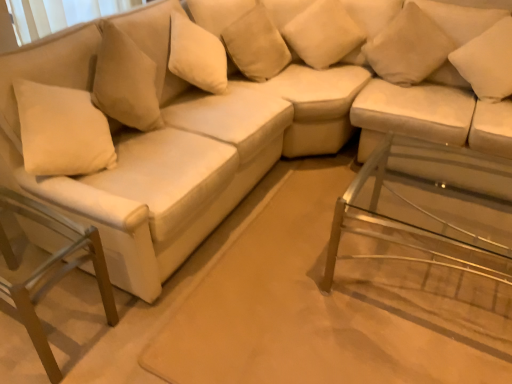
Question: Does metallic silver swivel chair at lower left come in front of beige fabric pillow at upper center, which appears as the 3th pillow when viewed from the right?

Choices:
 (A) yes
 (B) no

Answer: (A)

Question: Considering the relative sizes of metallic silver swivel chair at lower left and beige fabric pillow at upper center, which ranks as the 2th pillow in left-to-right order, in the image provided, is metallic silver swivel chair at lower left taller than beige fabric pillow at upper center, which ranks as the 2th pillow in left-to-right order,?

Choices:
 (A) yes
 (B) no

Answer: (A)

Question: Considering the relative sizes of metallic silver swivel chair at lower left and beige fabric pillow at upper center, which appears as the 3th pillow when viewed from the right, in the image provided, is metallic silver swivel chair at lower left smaller than beige fabric pillow at upper center, which appears as the 3th pillow when viewed from the right,?

Choices:
 (A) yes
 (B) no

Answer: (B)

Question: Can you confirm if metallic silver swivel chair at lower left is wider than beige fabric pillow at upper center, which ranks as the 2th pillow in left-to-right order?

Choices:
 (A) yes
 (B) no

Answer: (A)

Question: Would you say metallic silver swivel chair at lower left is outside beige fabric pillow at upper center, which appears as the 3th pillow when viewed from the right?

Choices:
 (A) no
 (B) yes

Answer: (B)

Question: Considering the positions of suede-like beige pillow at upper center, positioned as the 1th pillow in left-to-right order, and clear glass side table at lower right in the image, is suede-like beige pillow at upper center, positioned as the 1th pillow in left-to-right order, bigger or smaller than clear glass side table at lower right?

Choices:
 (A) big
 (B) small

Answer: (B)

Question: Considering the positions of point (260, 74) and point (420, 147), is point (260, 74) closer or farther from the camera than point (420, 147)?

Choices:
 (A) farther
 (B) closer

Answer: (A)

Question: From a real-world perspective, is suede-like beige pillow at upper center, placed as the 4th pillow when sorted from right to left, physically located above or below clear glass side table at lower right?

Choices:
 (A) above
 (B) below

Answer: (A)

Question: Is suede-like beige pillow at upper center, placed as the 4th pillow when sorted from right to left, situated inside clear glass side table at lower right or outside?

Choices:
 (A) inside
 (B) outside

Answer: (B)

Question: From their relative heights in the image, would you say beige fabric pillow at upper center, which ranks as the 2th pillow in left-to-right order, is taller or shorter than suede-like beige pillow at upper center, positioned as the 1th pillow in left-to-right order?

Choices:
 (A) short
 (B) tall

Answer: (A)

Question: Relative to suede-like beige pillow at upper center, positioned as the 1th pillow in left-to-right order, is beige fabric pillow at upper center, which appears as the 3th pillow when viewed from the right, in front or behind?

Choices:
 (A) front
 (B) behind

Answer: (B)

Question: Is beige fabric pillow at upper center, which appears as the 3th pillow when viewed from the right, wider or thinner than suede-like beige pillow at upper center, placed as the 4th pillow when sorted from right to left?

Choices:
 (A) wide
 (B) thin

Answer: (A)

Question: From the image's perspective, is beige fabric pillow at upper center, which appears as the 3th pillow when viewed from the right, above or below suede-like beige pillow at upper center, positioned as the 1th pillow in left-to-right order?

Choices:
 (A) above
 (B) below

Answer: (A)

Question: Visually, is beige fabric pillow at upper center, which ranks as the 2th pillow in left-to-right order, positioned to the left or to the right of white soft cushion at upper right, arranged as the 1th pillow when viewed from the right?

Choices:
 (A) left
 (B) right

Answer: (A)

Question: Is point (309, 26) positioned closer to the camera than point (501, 51)?

Choices:
 (A) closer
 (B) farther

Answer: (B)